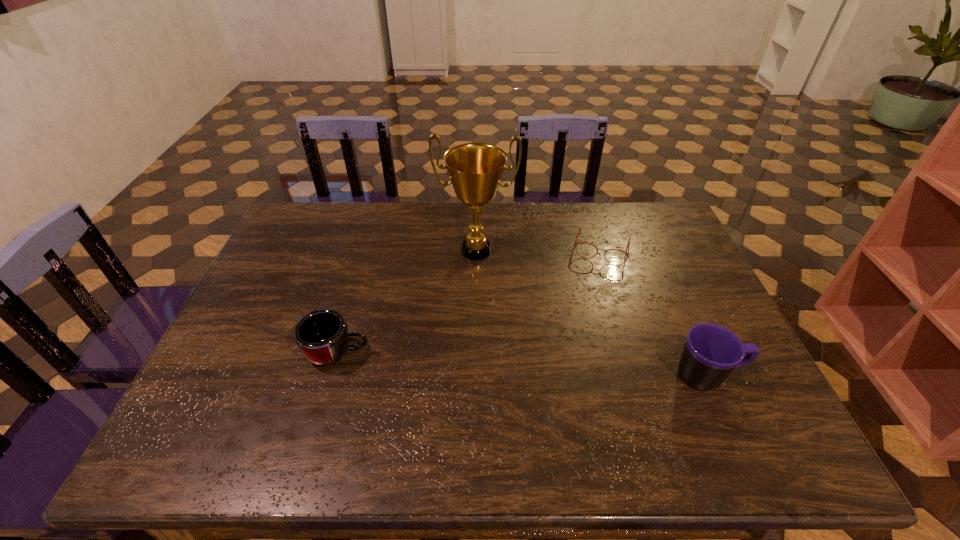
Image resolution: width=960 pixels, height=540 pixels. I want to click on vacant area that lies between the right mug and the shortest object, so click(655, 312).

Locate an element on the screen. The height and width of the screenshot is (540, 960). vacant area that lies between the left mug and the tallest object is located at coordinates (407, 302).

I want to click on free spot between the tallest object and the right mug, so click(592, 313).

Where is `free space that is in between the taller mug and the award`? free space that is in between the taller mug and the award is located at coordinates (592, 313).

Point out which object is positioned as the second nearest to the second shortest object. Please provide its 2D coordinates. Your answer should be formatted as a tuple, i.e. [(x, y)], where the tuple contains the x and y coordinates of a point satisfying the conditions above.

[(579, 228)]

Image resolution: width=960 pixels, height=540 pixels. What are the coordinates of `object that stands as the closest to the award` in the screenshot? It's located at (579, 228).

At what (x,y) coordinates should I click in order to perform the action: click on vacant space that satisfies the following two spatial constraints: 1. on the front side of the award; 2. with the handle on the side of the third shortest object. Please return your answer as a coordinate pair (x, y). The width and height of the screenshot is (960, 540). Looking at the image, I should click on (475, 376).

You are a GUI agent. You are given a task and a screenshot of the screen. Output one action in this format:
    pyautogui.click(x=<x>, y=<y>)
    Task: Click on the free space that satisfies the following two spatial constraints: 1. on the back side of the second object from left to right; 2. on the right side of the shortest object
    The width and height of the screenshot is (960, 540).
    Given the screenshot: What is the action you would take?
    pyautogui.click(x=476, y=249)